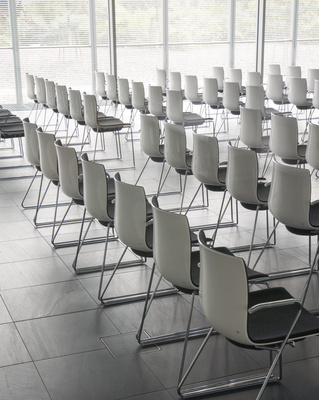
This screenshot has height=400, width=319. What are the coordinates of `back row chair` in the screenshot? It's located at (1, 106), (10, 117), (11, 128), (29, 129), (44, 144), (61, 154), (116, 178), (99, 181), (170, 224), (217, 270).